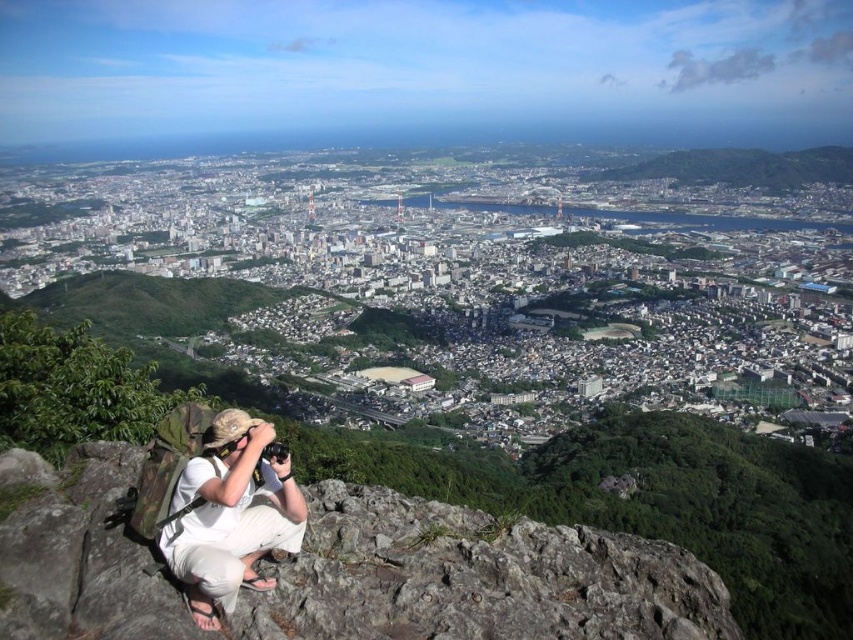
Question: Can you confirm if gray rocky cliff at lower left is thinner than white cotton shirt at lower left?

Choices:
 (A) no
 (B) yes

Answer: (A)

Question: Is gray rocky cliff at lower left in front of white cotton shirt at lower left?

Choices:
 (A) no
 (B) yes

Answer: (B)

Question: Can you confirm if gray rocky cliff at lower left is wider than white cotton shirt at lower left?

Choices:
 (A) no
 (B) yes

Answer: (B)